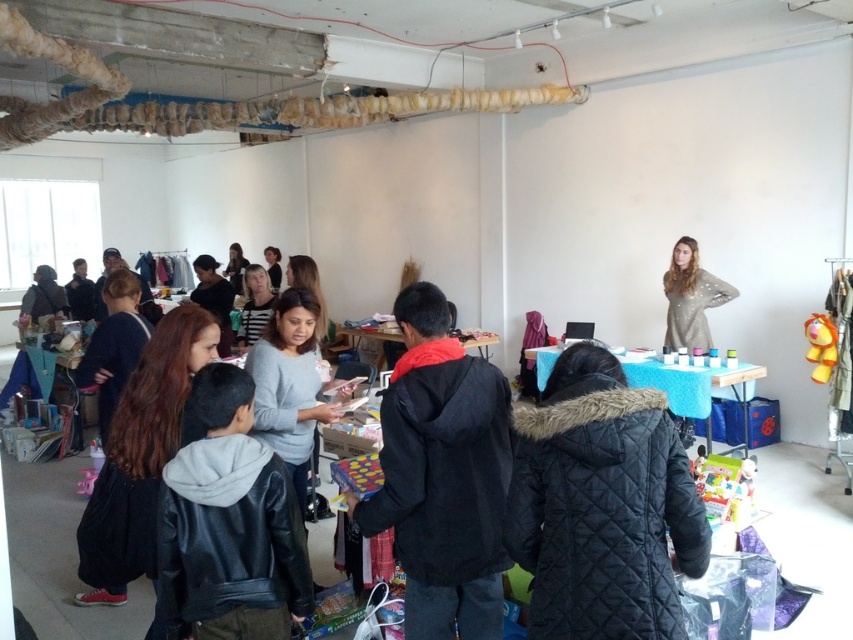
You are standing in the room and want to pick up the dark brown leather jacket at lower left. Which direction should you move relative to the matte black jacket at center?

The dark brown leather jacket at lower left is located below the matte black jacket at center, so you should move downward or towards the lower area relative to the matte black jacket at center to pick it up.

You are helping organize a clothing donation drive and need to categorize items by size. You see a matte gray sweater at center and a matte black jacket at center. Which item should you place in the small size bin?

The matte gray sweater at center should be placed in the small size bin because it has a smaller size compared to the matte black jacket at center.

You are a person standing in the middle of the room and want to reach the entrance located at the back. There is a dark brown leather jacket at lower left and a gray matte sweater at center in your way. Which obstacle is closer to you?

The gray matte sweater at center is closer to you because it is positioned at the center, while the dark brown leather jacket at lower left is further away. Since the dark brown leather jacket at lower left is taller than the gray matte sweater at center, you might need to step around both, but the gray matte sweater at center is nearer.